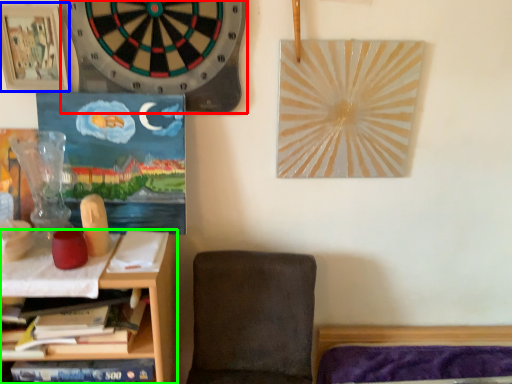
Question: Which is nearer to the clock (highlighted by a red box)? picture frame (highlighted by a blue box) or shelf (highlighted by a green box).

Choices:
 (A) picture frame
 (B) shelf

Answer: (A)